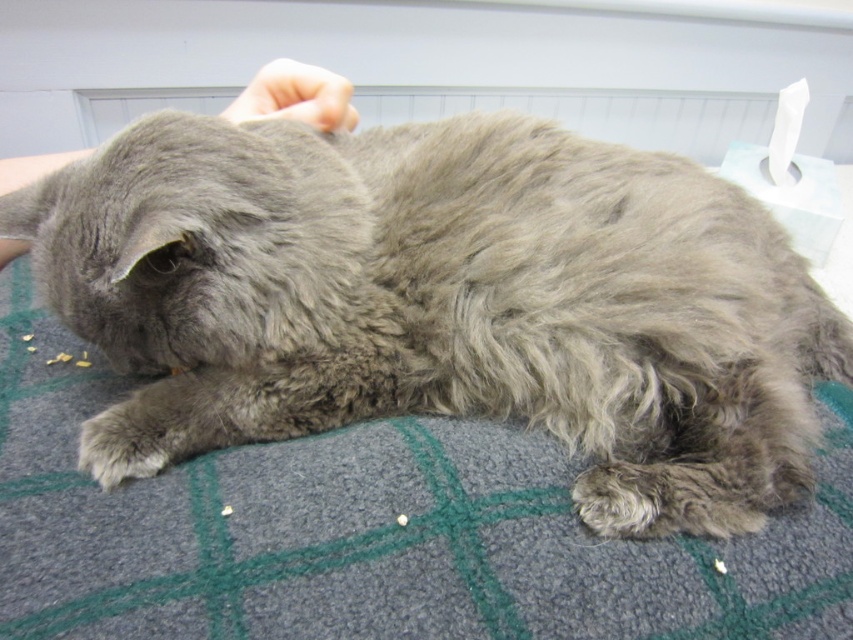
Question: Does gray fluffy cat at center have a greater width compared to smooth skin hand at upper center?

Choices:
 (A) no
 (B) yes

Answer: (B)

Question: Which point is farther to the camera?

Choices:
 (A) (84, 260)
 (B) (309, 106)

Answer: (B)

Question: Can you confirm if gray fluffy cat at center is smaller than smooth skin hand at upper center?

Choices:
 (A) no
 (B) yes

Answer: (A)

Question: Does gray fluffy cat at center come behind smooth skin hand at upper center?

Choices:
 (A) no
 (B) yes

Answer: (A)